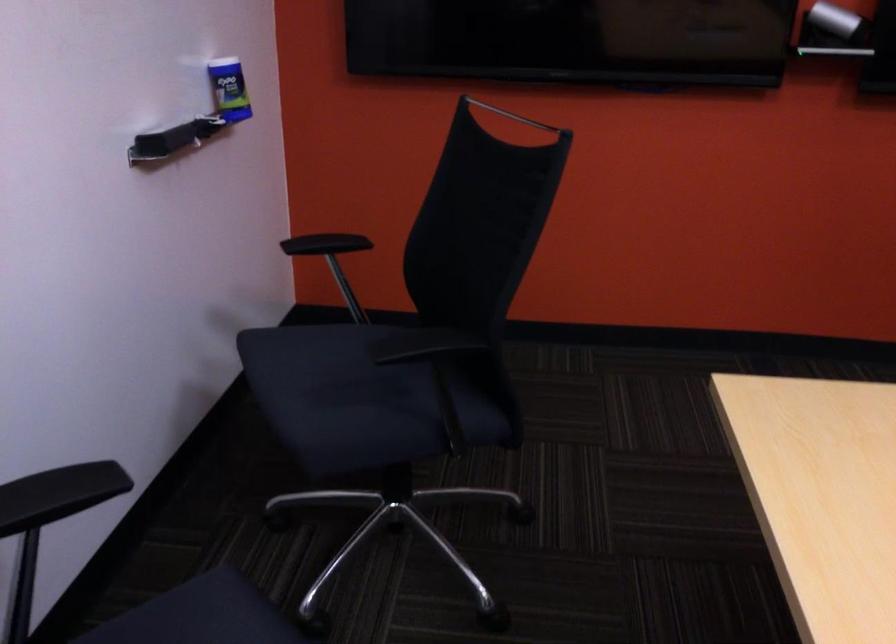
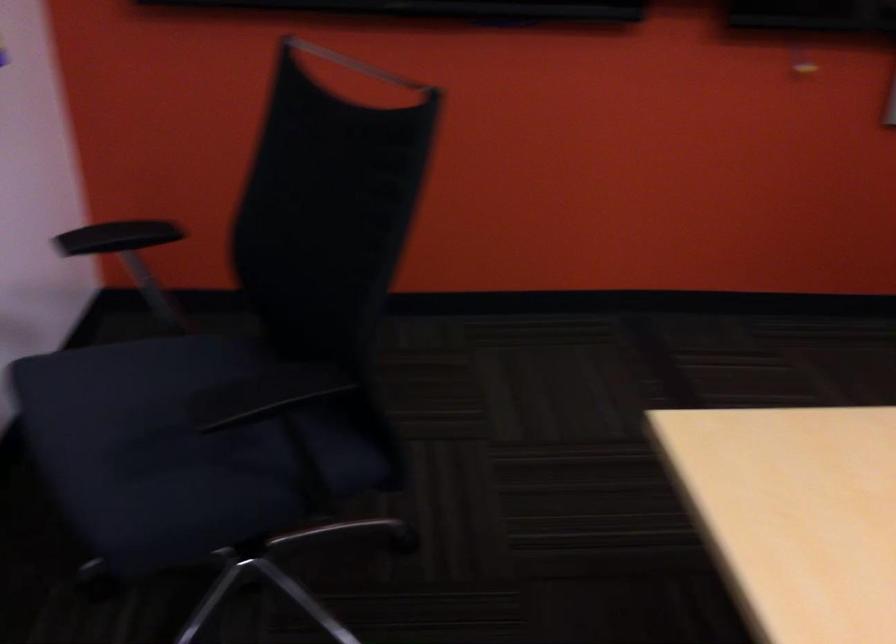
In the second image, find the point that corresponds to point 521,120 in the first image.

(356, 64)